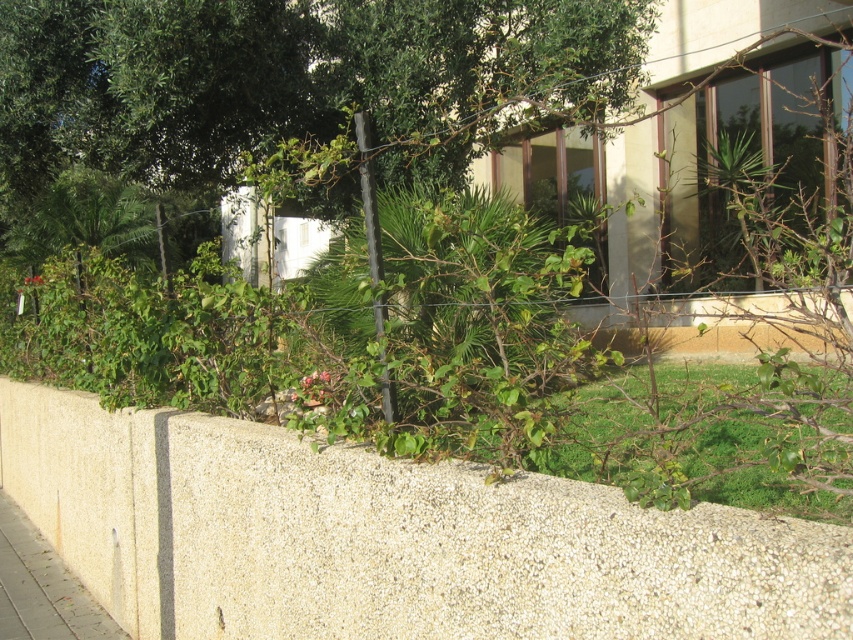
You are a gardener who needs to place a 4.5 meter long hose between the beige concrete wall at lower left and the gray concrete pavement at lower left. Can the hose fit in the space between them?

The distance between the beige concrete wall at lower left and the gray concrete pavement at lower left is 4.19 meters. Since the hose is 4.5 meters long, which is longer than the available space, the hose cannot fit entirely between them.

You are a gardener who needs to place a 1.2 meter tall flower pot between the beige concrete wall at lower left and the gray concrete pavement at lower left. Based on their positions, can the flower pot be placed there without hitting either structure?

The beige concrete wall at lower left is located above the gray concrete pavement at lower left. Since the wall is above the pavement, there is enough vertical space to place the flower pot between them. The flower pot can be placed between the beige concrete wall at lower left and the gray concrete pavement at lower left as long as its height does not exceed the vertical gap between them. However, the exact vertical clearance isn